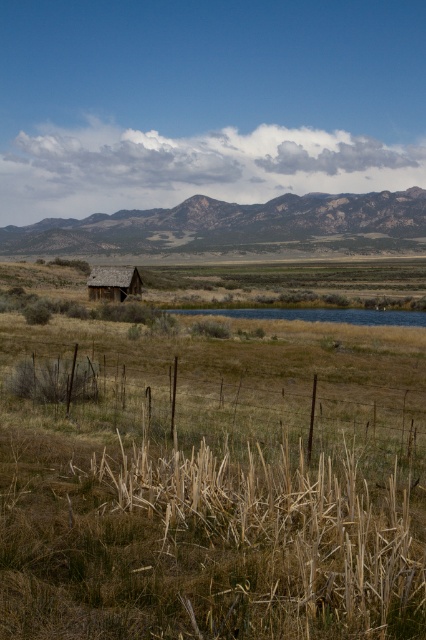
You are a hiker who wants to reach the brown wooden hut at left from your current position. The rocky brown mountain at center is blocking your path. Can you walk around the mountain to reach the hut?

The brown wooden hut at left is behind the rocky brown mountain at center, so you cannot directly reach the hut by walking around the mountain since the mountain is between you and the hut.

Consider the image. You are standing at the center of the image and want to walk towards the rocky brown mountain at center. Which direction should you face to head directly towards it?

The rocky brown mountain at center is located at point [224,224], so you should face slightly to the left and forward to head directly towards it.